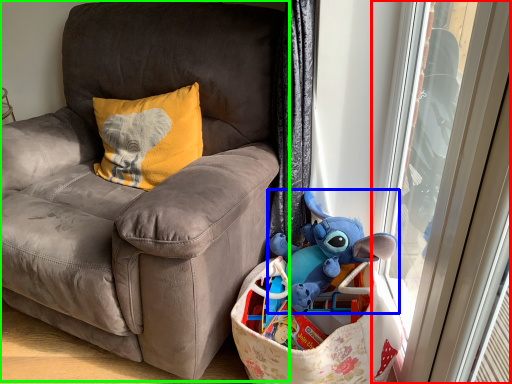
Question: Considering the real-world distances, which object is farthest from screen door (highlighted by a red box)? toy (highlighted by a blue box) or chair (highlighted by a green box)?

Choices:
 (A) toy
 (B) chair

Answer: (B)